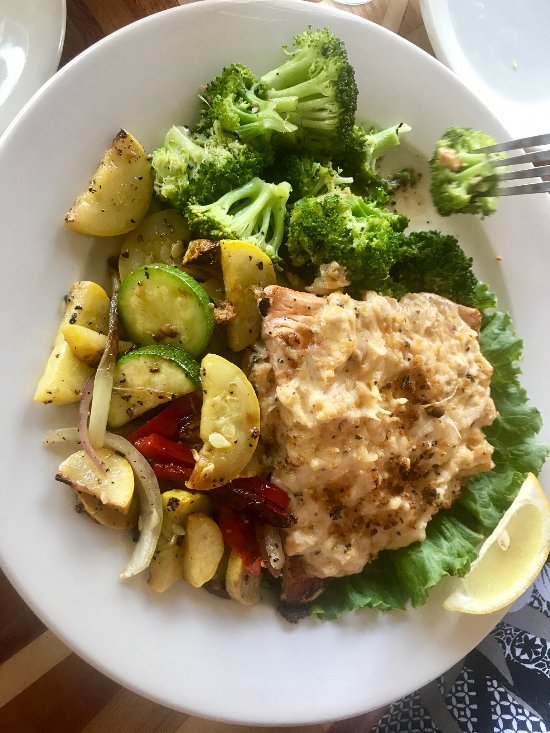
Locate an element on the screen. The image size is (550, 733). fork is located at coordinates (518, 151).